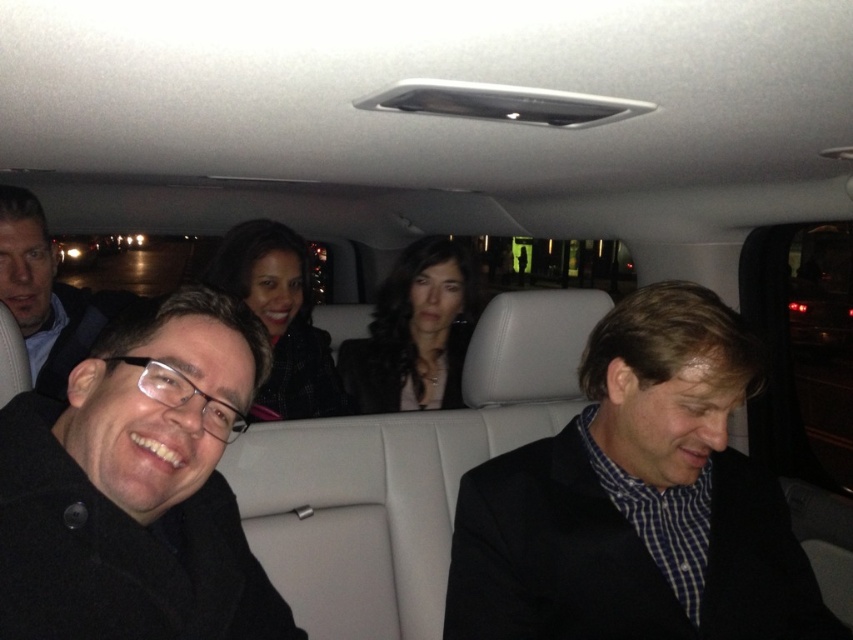
Question: Considering the real-world distances, which object is closest to the matte black glasses at left?

Choices:
 (A) dark blue checkered shirt at center
 (B) matte black jacket at center
 (C) black matte coat at lower left
 (D) smooth black hair at center

Answer: (B)

Question: Does dark blue checkered shirt at center appear on the right side of matte black glasses at left?

Choices:
 (A) no
 (B) yes

Answer: (B)

Question: Among these objects, which one is farthest from the camera?

Choices:
 (A) matte black jacket at center
 (B) dark blue checkered shirt at center

Answer: (A)

Question: Is black matte coat at lower left smaller than smooth black hair at center?

Choices:
 (A) yes
 (B) no

Answer: (A)

Question: Is smooth black hair at center wider than matte black jacket at center?

Choices:
 (A) yes
 (B) no

Answer: (A)

Question: Which point is farther to the camera?

Choices:
 (A) matte black glasses at left
 (B) matte black jacket at center
 (C) dark blue checkered shirt at center

Answer: (B)